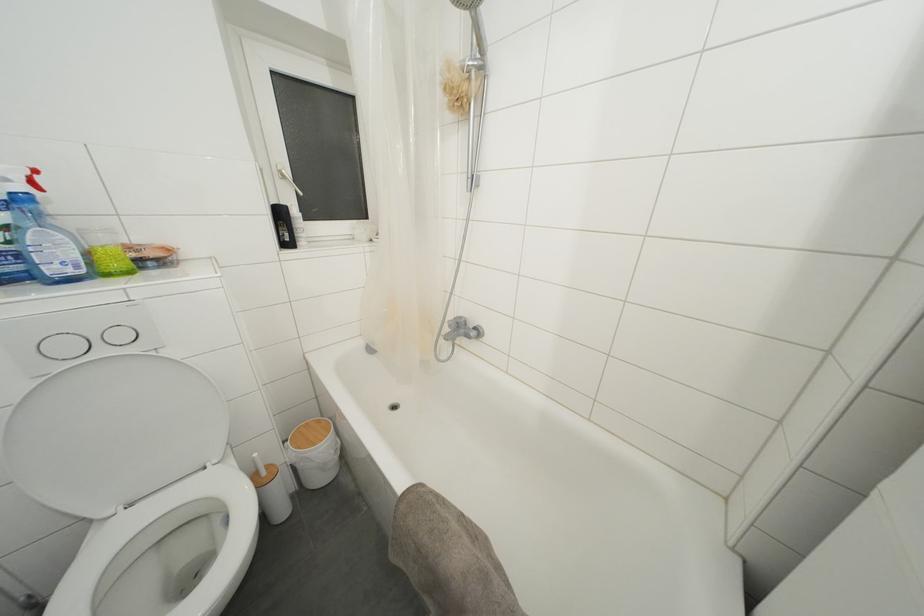
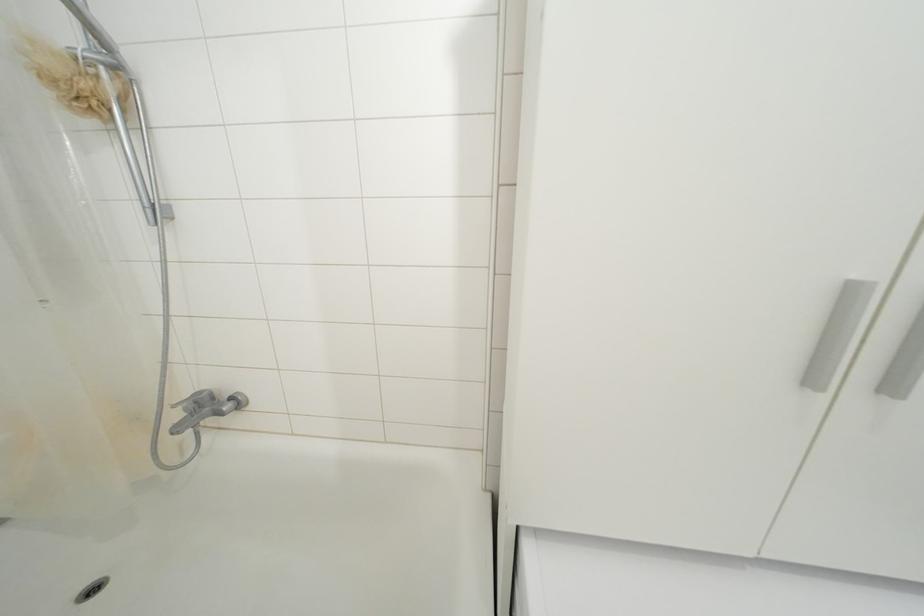
Where in the second image is the point corresponding to (472,84) from the first image?

(100, 79)